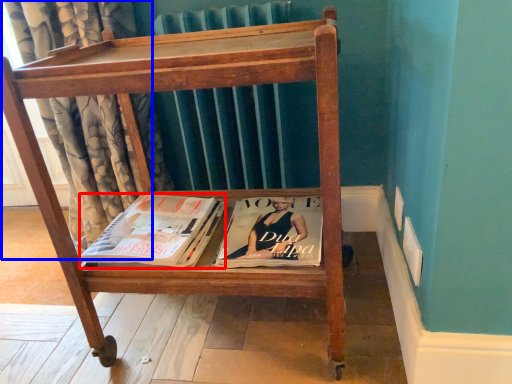
Question: Which point is closer to the camera, book (highlighted by a red box) or curtain (highlighted by a blue box)?

Choices:
 (A) book
 (B) curtain

Answer: (A)